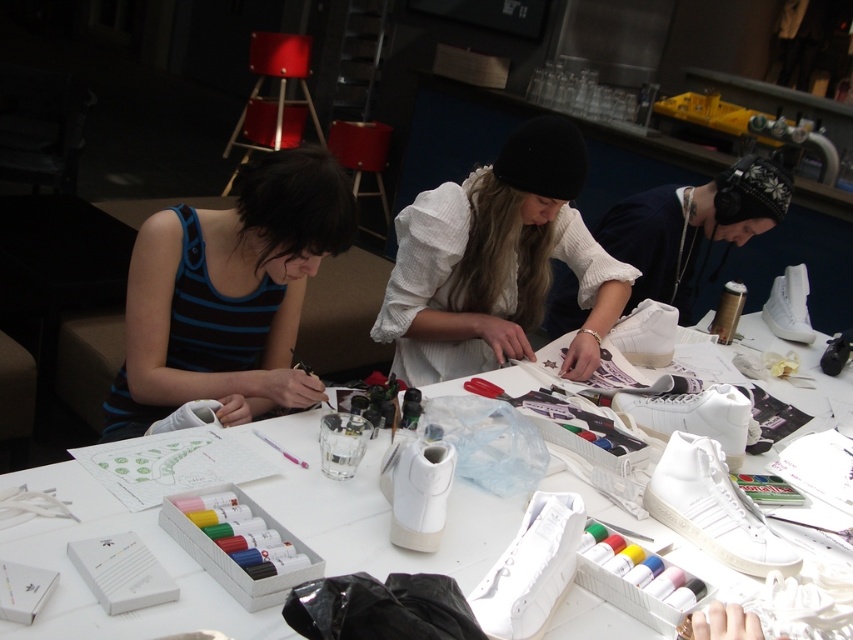
Question: Which point is closer to the camera?

Choices:
 (A) [285, 253]
 (B) [850, 380]
 (C) [521, 152]
 (D) [686, 284]

Answer: (A)

Question: Estimate the real-world distances between objects in this image. Which object is farther from the blue striped tank top at left?

Choices:
 (A) white cotton shirt at center
 (B) white matte sneakers at center

Answer: (A)

Question: Is white matte sneakers at center smaller than white matte sneaker at center?

Choices:
 (A) no
 (B) yes

Answer: (A)

Question: Which point is closer to the camera taking this photo?

Choices:
 (A) 166,406
 (B) 637,264
 (C) 461,184
 (D) 599,499

Answer: (D)

Question: Is white matte sneakers at center above white cotton shirt at center?

Choices:
 (A) no
 (B) yes

Answer: (A)

Question: Is blue striped tank top at left smaller than white matte sneaker at center?

Choices:
 (A) yes
 (B) no

Answer: (A)